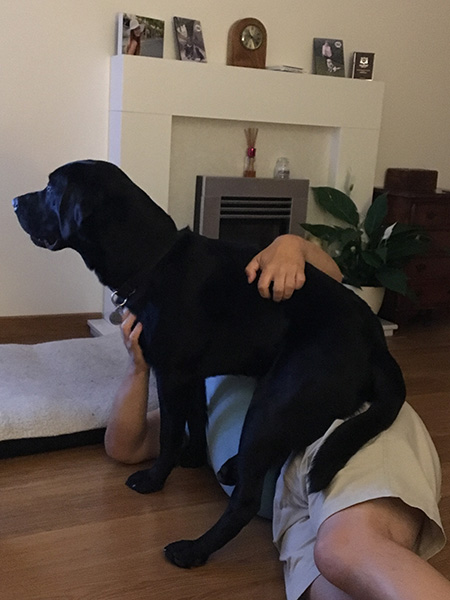
Image resolution: width=450 pixels, height=600 pixels. I want to click on family photo, so click(146, 33), click(193, 50), click(324, 52).